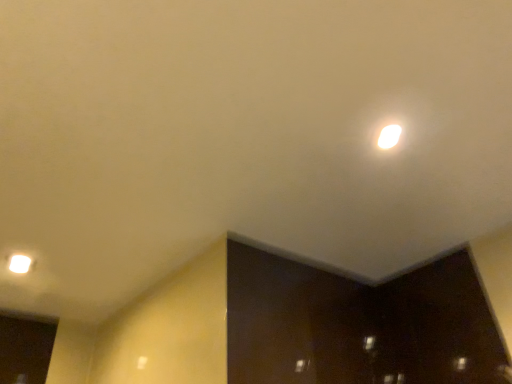
Where is `white glossy light at upper right`? white glossy light at upper right is located at coordinates (389, 136).

Image resolution: width=512 pixels, height=384 pixels. What do you see at coordinates (389, 136) in the screenshot?
I see `white glossy light at upper right` at bounding box center [389, 136].

This screenshot has height=384, width=512. What are the coordinates of `white glossy light at upper right` in the screenshot? It's located at (389, 136).